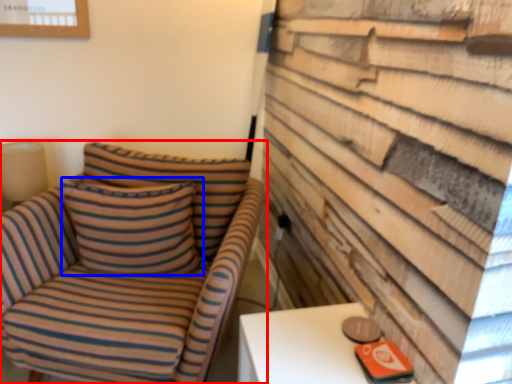
Question: Which point is closer to the camera, chair (highlighted by a red box) or pillow (highlighted by a blue box)?

Choices:
 (A) chair
 (B) pillow

Answer: (A)